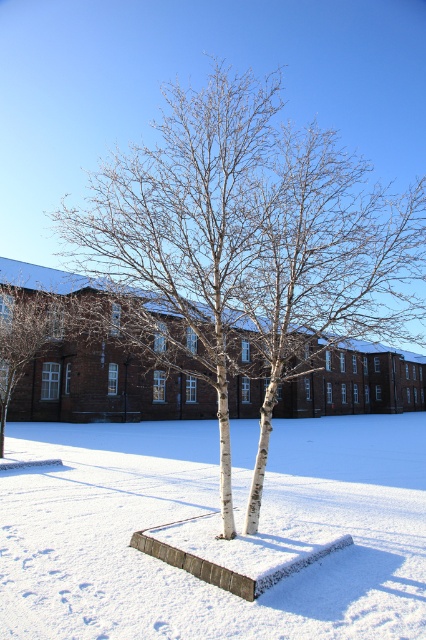
In the scene shown: You are a delivery drone with a maximum flight range of 30 feet. You need to deliver a package from the white bark tree at center to the white powdery snow at center. Can you complete the delivery without needing to recharge?

The white bark tree at center is 35.88 feet away from white powdery snow at center. Since the distance exceeds the drone s maximum flight range of 30 feet, the drone cannot complete the delivery without recharging.

You are a painter who wants to capture the winter scene accurately. You notice the white bark tree at center and the white powdery snow at center. Which object should you paint first if you want to depict the one that is taller?

The white bark tree at center should be painted first because it has a greater height compared to the white powdery snow at center.